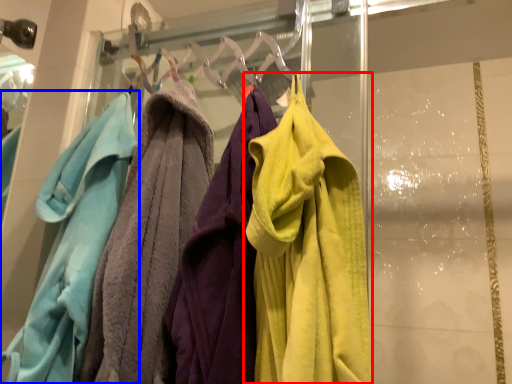
Question: Which point is closer to the camera, towel (highlighted by a red box) or towel (highlighted by a blue box)?

Choices:
 (A) towel
 (B) towel

Answer: (A)